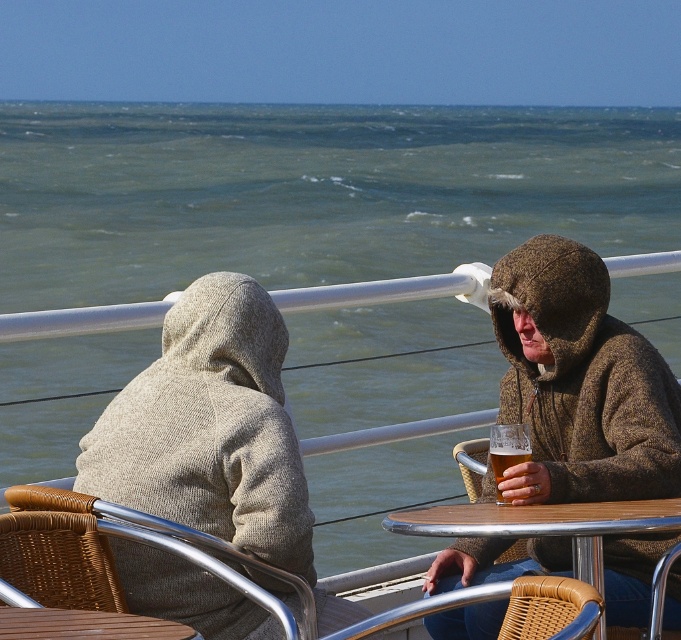
Question: Which object appears farthest from the camera in this image?

Choices:
 (A) greenish-blue water at center
 (B) brown wood table at lower left
 (C) translucent glass beer at right
 (D) brown woolen jacket at center

Answer: (A)

Question: Is brown woolen jacket at center above translucent glass beer at right?

Choices:
 (A) yes
 (B) no

Answer: (A)

Question: Based on their relative distances, which object is farther from the greenish-blue water at center?

Choices:
 (A) wooden table at center
 (B) gray wool hoodie at center
 (C) brown wood table at lower left
 (D) translucent glass beer at right

Answer: (D)

Question: Does greenish-blue water at center appear over brown woolen jacket at center?

Choices:
 (A) yes
 (B) no

Answer: (A)

Question: Does greenish-blue water at center have a lesser width compared to wooden table at center?

Choices:
 (A) yes
 (B) no

Answer: (B)

Question: Which object is farther from the camera taking this photo?

Choices:
 (A) translucent glass beer at right
 (B) greenish-blue water at center
 (C) brown wood table at lower left

Answer: (B)